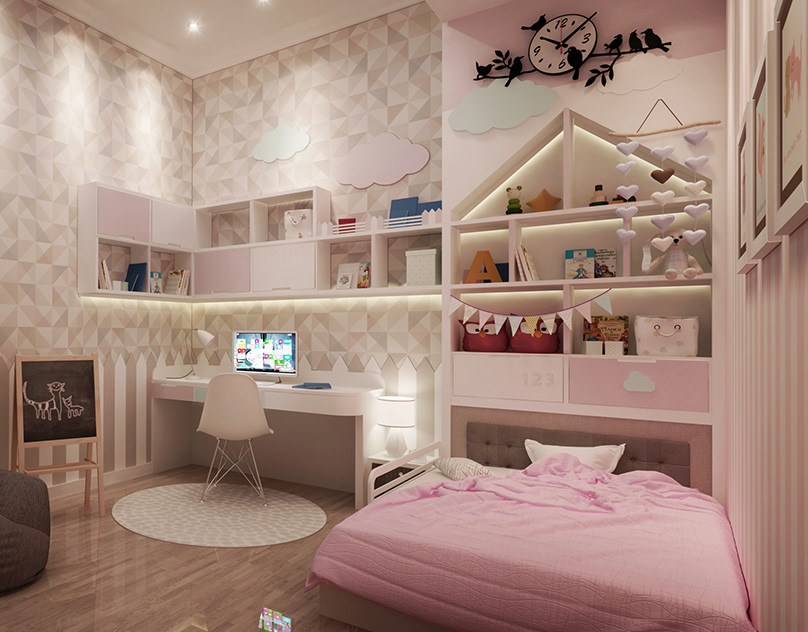
Identify the location of computer monitor. (266, 356).